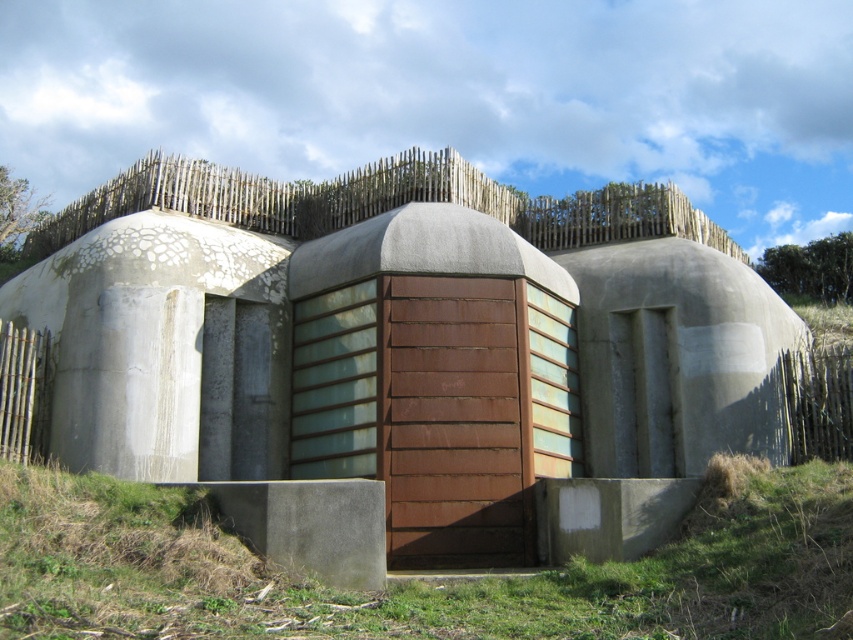
Question: Which point appears closest to the camera in this image?

Choices:
 (A) (383, 211)
 (B) (3, 628)

Answer: (B)

Question: Which of the following is the farthest from the observer?

Choices:
 (A) rusty metal door at center
 (B) green grass at lower center

Answer: (A)

Question: Does rusty metal door at center have a smaller size compared to green grass at lower center?

Choices:
 (A) no
 (B) yes

Answer: (A)

Question: Does rusty metal door at center have a larger size compared to green grass at lower center?

Choices:
 (A) no
 (B) yes

Answer: (B)

Question: Can you confirm if rusty metal door at center is positioned to the right of green grass at lower center?

Choices:
 (A) yes
 (B) no

Answer: (B)